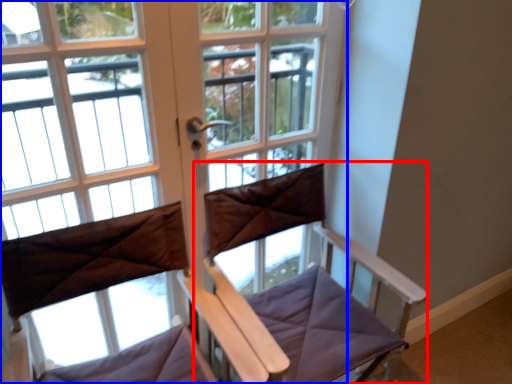
Question: Among these objects, which one is nearest to the camera, feeding chair (highlighted by a red box) or window (highlighted by a blue box)?

Choices:
 (A) feeding chair
 (B) window

Answer: (A)